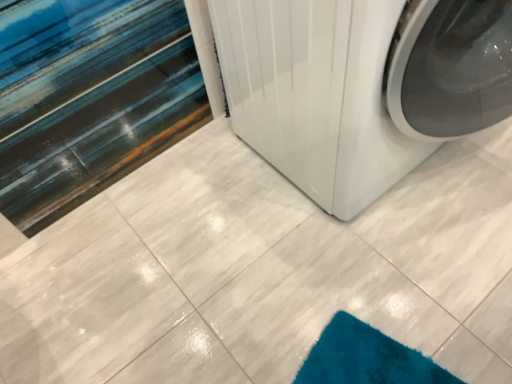
Where is `white glossy washing machine at center`? white glossy washing machine at center is located at coordinates (360, 85).

Describe the element at coordinates (360, 85) in the screenshot. The height and width of the screenshot is (384, 512). I see `white glossy washing machine at center` at that location.

The height and width of the screenshot is (384, 512). I want to click on white glossy washing machine at center, so click(x=360, y=85).